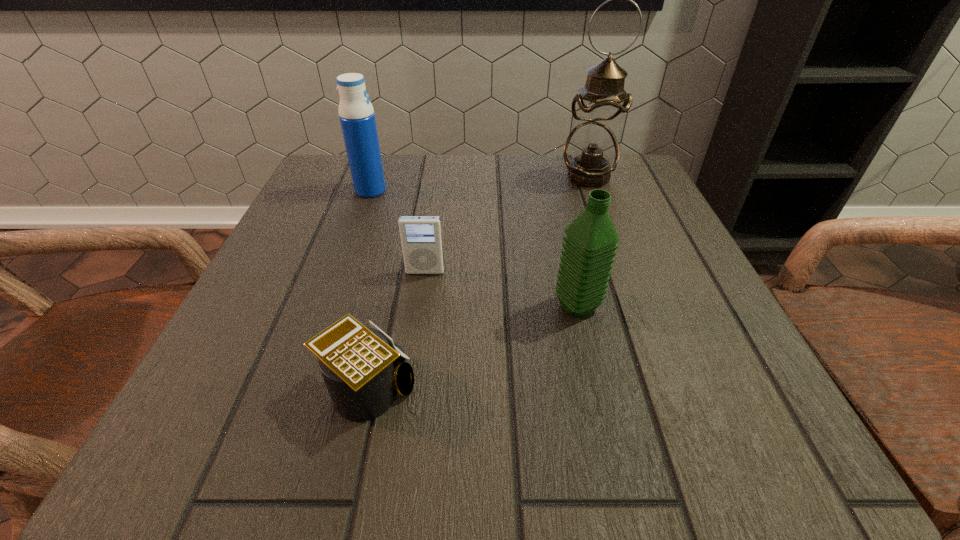
At what (x,y) coordinates should I click in order to perform the action: click on vacant position located on the left of the third tallest object. Please return your answer as a coordinate pair (x, y). Looking at the image, I should click on pyautogui.click(x=453, y=306).

Find the location of a particular element. Image resolution: width=960 pixels, height=540 pixels. free region located on the front-facing side of the second shortest object is located at coordinates pos(419,319).

Locate an element on the screen. free location located 0.070m on the right of the nearest object is located at coordinates (467, 390).

Locate an element on the screen. oil lamp at the far edge is located at coordinates (591, 152).

Identify the location of water bottle located in the far edge section of the desktop. (356, 113).

In order to click on object that is at the near edge in this screenshot , I will do `click(363, 370)`.

You are a GUI agent. You are given a task and a screenshot of the screen. Output one action in this format:
    pyautogui.click(x=<x>, y=<y>)
    Task: Click on the object that is at the left edge
    The height and width of the screenshot is (540, 960).
    Given the screenshot: What is the action you would take?
    pyautogui.click(x=356, y=113)

You are a GUI agent. You are given a task and a screenshot of the screen. Output one action in this format:
    pyautogui.click(x=<x>, y=<y>)
    Task: Click on the object positioned at the right edge
    The width and height of the screenshot is (960, 540).
    Given the screenshot: What is the action you would take?
    pyautogui.click(x=591, y=152)

Locate an element on the screen. The height and width of the screenshot is (540, 960). object located at the far left corner is located at coordinates (356, 113).

The height and width of the screenshot is (540, 960). In order to click on object that is at the far right corner in this screenshot , I will do `click(591, 152)`.